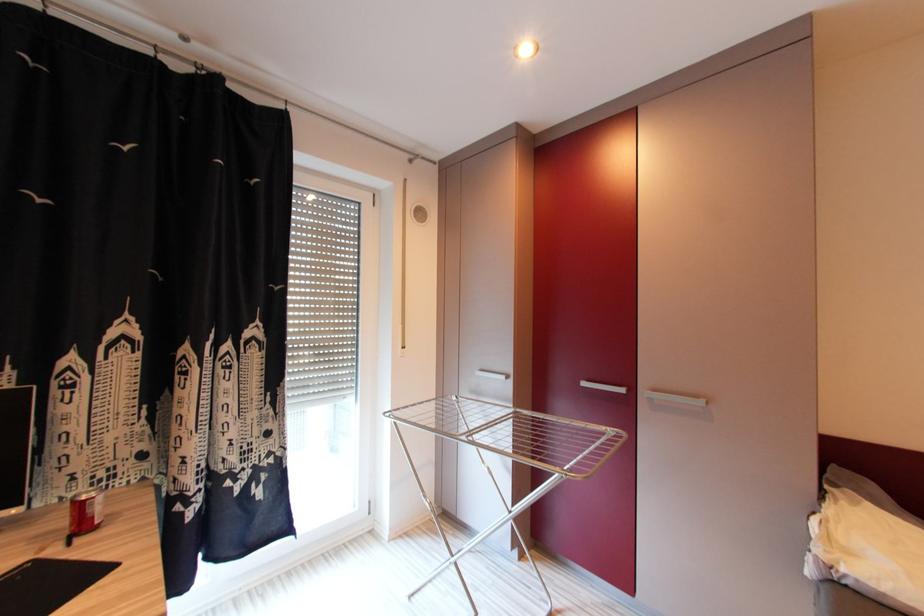
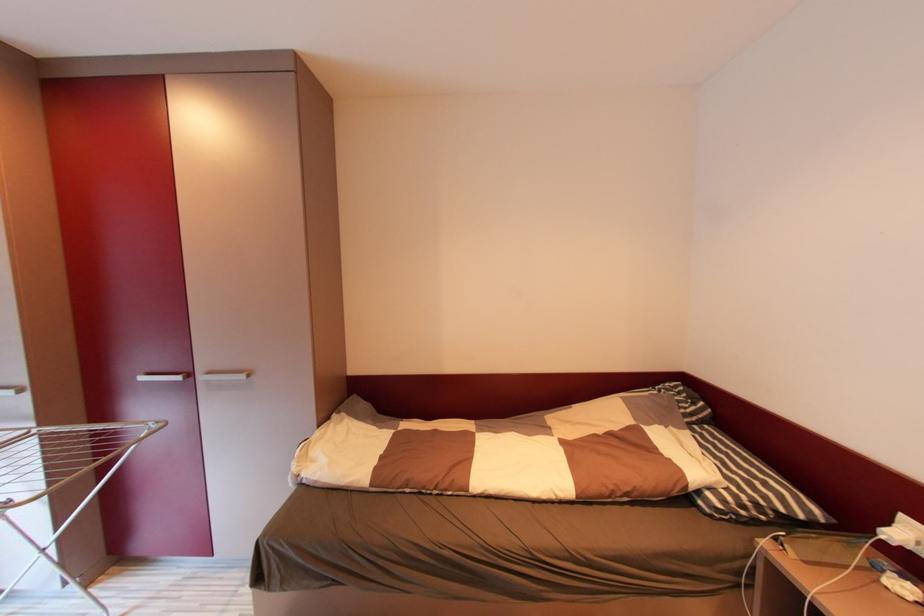
Question: The camera is either moving clockwise (left) or counter-clockwise (right) around the object. The first image is from the beginning of the video and the second image is from the end. Is the camera moving left or right when shooting the video?

Choices:
 (A) Left
 (B) Right

Answer: (A)